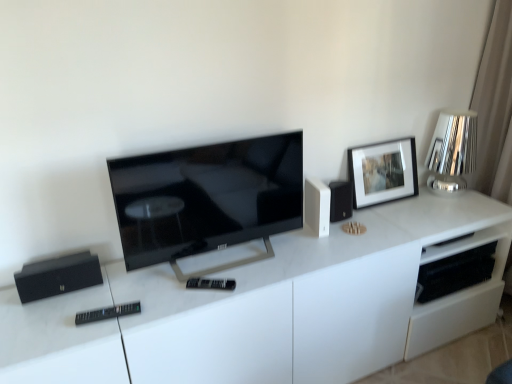
Locate an element on the screen. free area in between black plastic remote at lower left, marked as the second remote in a right-to-left arrangement, and shiny metallic lamp at upper right is located at coordinates (314, 245).